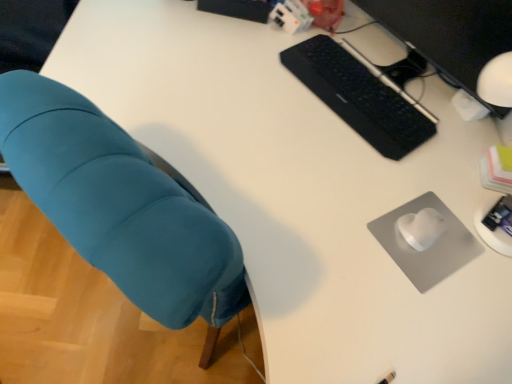
Find the location of `free space to the back side of black matte keyboard at upper right`. free space to the back side of black matte keyboard at upper right is located at coordinates (375, 52).